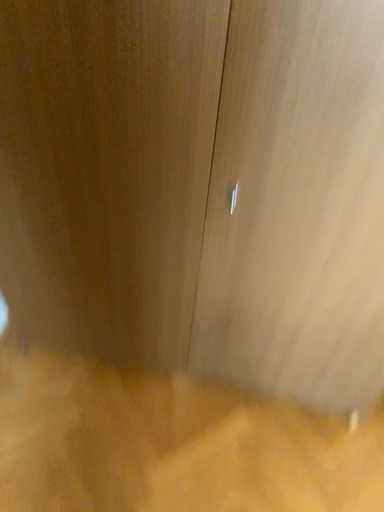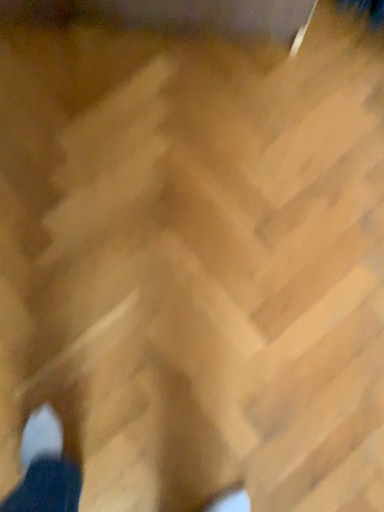
Question: Which way did the camera rotate in the video?

Choices:
 (A) rotated downward
 (B) rotated upward

Answer: (A)